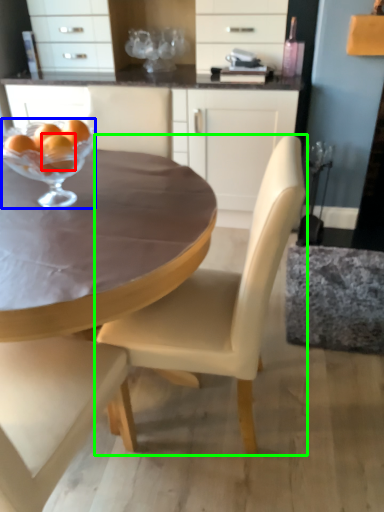
Question: Which is nearer to the tangerine (highlighted by a red box)? martini glass (highlighted by a blue box) or chair (highlighted by a green box).

Choices:
 (A) martini glass
 (B) chair

Answer: (A)